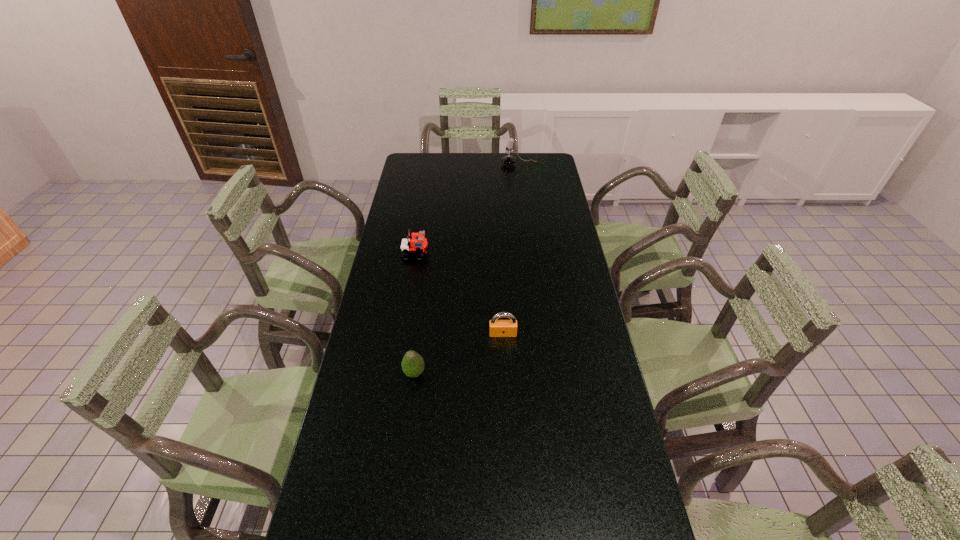
The image size is (960, 540). In order to click on Lego that is at the left edge in this screenshot , I will do `click(418, 245)`.

Identify the location of avocado positioned at the left edge. The image size is (960, 540). (412, 364).

The height and width of the screenshot is (540, 960). I want to click on object that is positioned at the right edge, so click(508, 159).

Where is `object that is positioned at the far right corner`? The image size is (960, 540). object that is positioned at the far right corner is located at coordinates (508, 159).

I want to click on vacant space at the far edge of the desktop, so click(449, 157).

The height and width of the screenshot is (540, 960). I want to click on vacant point at the left edge, so click(x=382, y=399).

Identify the location of vacant space at the right edge. The height and width of the screenshot is (540, 960). (532, 183).

In the image, there is a desktop. Where is `vacant region at the far right corner`? This screenshot has width=960, height=540. vacant region at the far right corner is located at coordinates (532, 177).

Where is `free space between the nearest object and the Lego`? free space between the nearest object and the Lego is located at coordinates (415, 314).

What are the coordinates of `unoccupied area between the third farthest object and the microphone` in the screenshot? It's located at (511, 249).